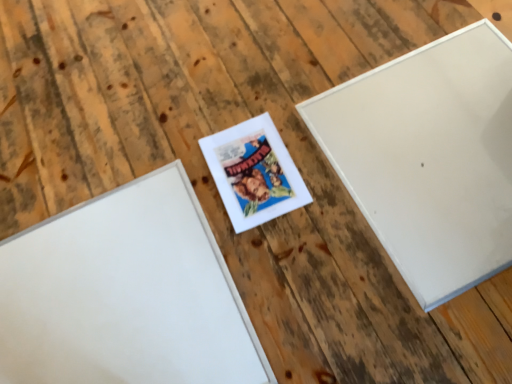
You are a GUI agent. You are given a task and a screenshot of the screen. Output one action in this format:
    pyautogui.click(x=<x>, y=<y>)
    Task: Click on the blank space above matte white picture frame at center, positioned as the second picture frame in right-to-left order (from a real-world perspective)
    Image resolution: width=512 pixels, height=384 pixels.
    Given the screenshot: What is the action you would take?
    pyautogui.click(x=256, y=173)